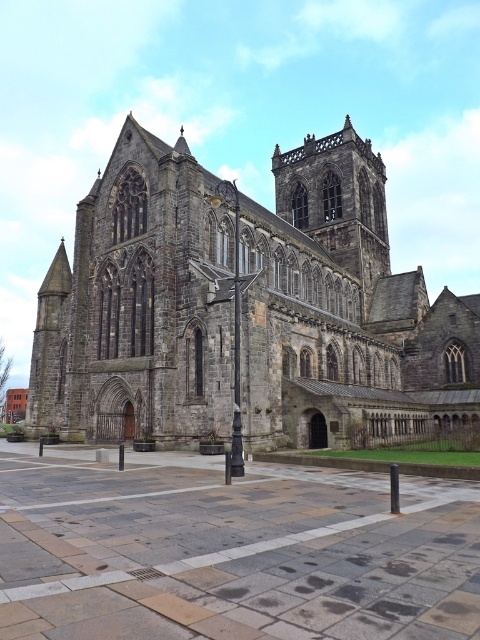
Question: Which point is farther to the camera?

Choices:
 (A) dark gray stone church at center
 (B) smooth black pole at center

Answer: (A)

Question: Which object is farther from the camera taking this photo?

Choices:
 (A) dark gray stone church at center
 (B) smooth black pole at center

Answer: (A)

Question: Is dark gray stone church at center smaller than smooth black pole at center?

Choices:
 (A) no
 (B) yes

Answer: (A)

Question: Which point is closer to the camera?

Choices:
 (A) smooth black pole at center
 (B) dark gray stone church at center

Answer: (A)

Question: Can you confirm if dark gray stone church at center is thinner than smooth black pole at center?

Choices:
 (A) no
 (B) yes

Answer: (A)

Question: Does dark gray stone church at center appear on the right side of smooth black pole at center?

Choices:
 (A) no
 (B) yes

Answer: (B)